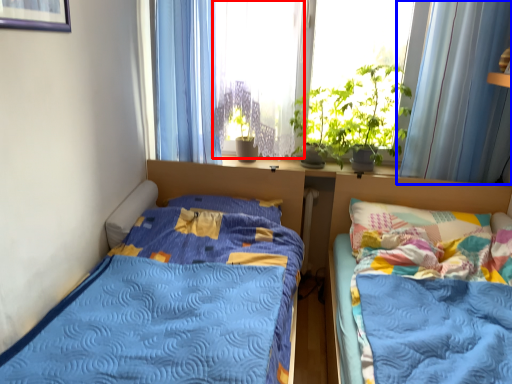
Question: Among these objects, which one is nearest to the camera, window screen (highlighted by a red box) or curtain (highlighted by a blue box)?

Choices:
 (A) window screen
 (B) curtain

Answer: (B)